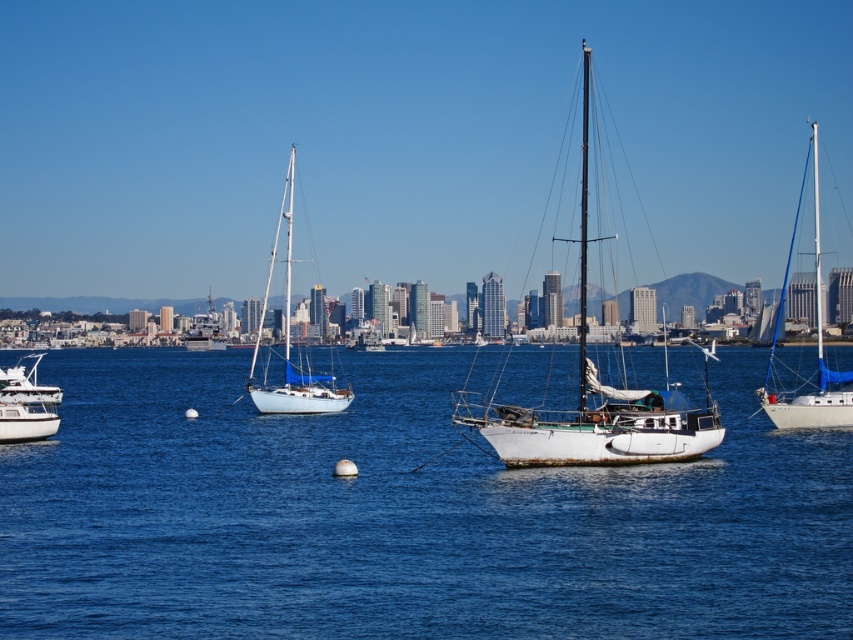
Question: Considering the relative positions of white matte sailboat at right and white glossy sailboat at left in the image provided, where is white matte sailboat at right located with respect to white glossy sailboat at left?

Choices:
 (A) above
 (B) below

Answer: (A)

Question: Which of these objects is positioned closest to the white matte sailboat at right?

Choices:
 (A) white glossy yacht at lower left
 (B) white glossy sailboat at left

Answer: (B)

Question: Which of the following is the farthest from the observer?

Choices:
 (A) metallic gray ship at center-left
 (B) white matte sailboat at right
 (C) white glossy sailboat at left

Answer: (A)

Question: Estimate the real-world distances between objects in this image. Which object is closer to the white matte sailboat at right?

Choices:
 (A) white glossy yacht at lower left
 (B) metallic gray ship at center-left
 (C) blue water at center

Answer: (C)

Question: Does blue water at center appear over white matte sailboat at right?

Choices:
 (A) yes
 (B) no

Answer: (B)

Question: Does rusty metal sailboat at center appear on the left side of white matte sailboat at right?

Choices:
 (A) yes
 (B) no

Answer: (A)